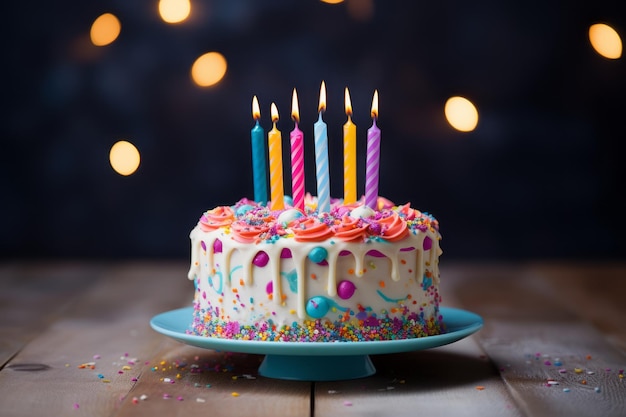
Identify the location of lights. (176, 9), (96, 27), (126, 158), (216, 70), (334, 2), (467, 120), (605, 51).